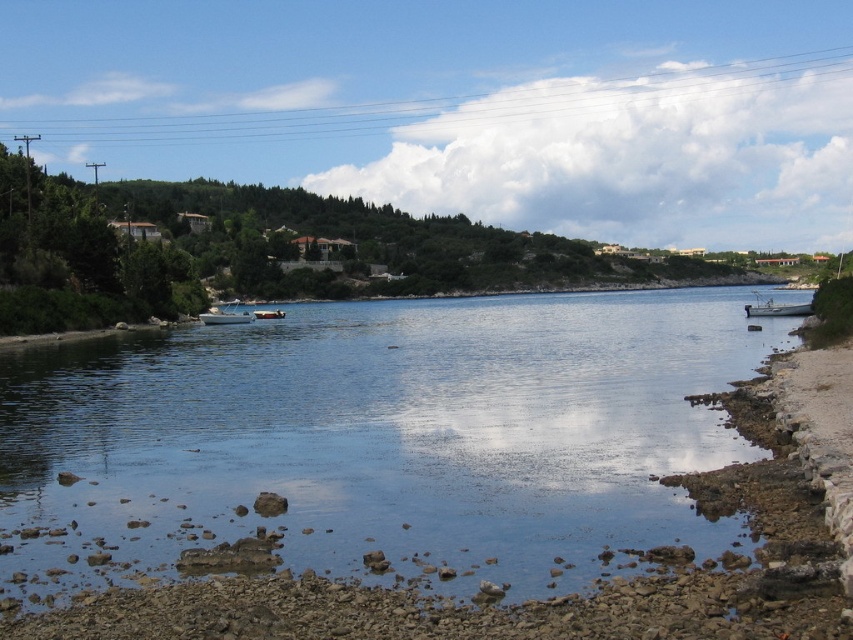
You are standing at the shore looking out at the scene. There are two points marked in the image. The first point is at coordinates point (636,465) and the second is at point (263,312). Which of these two points is closer to your viewpoint?

Point (636,465) is closer to the camera than point (263,312).